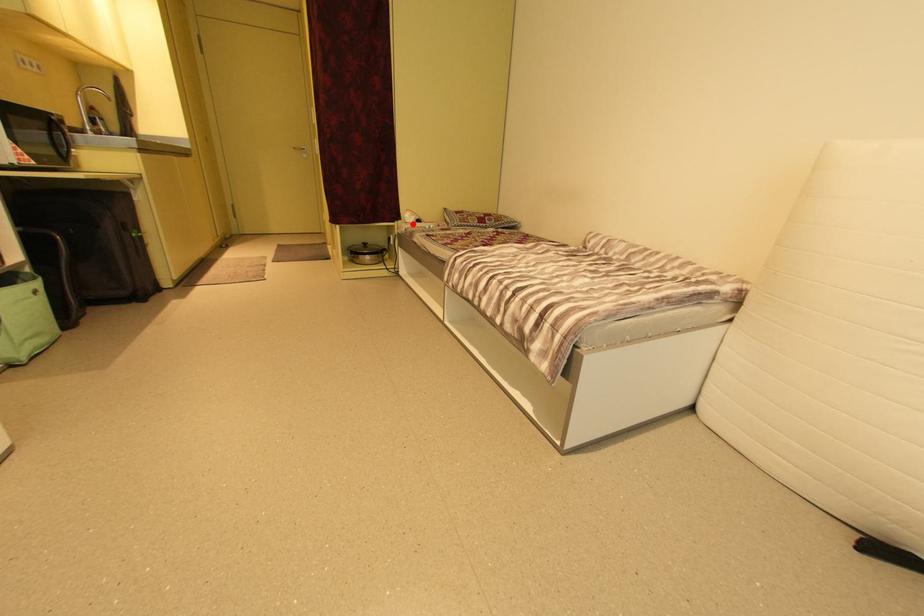
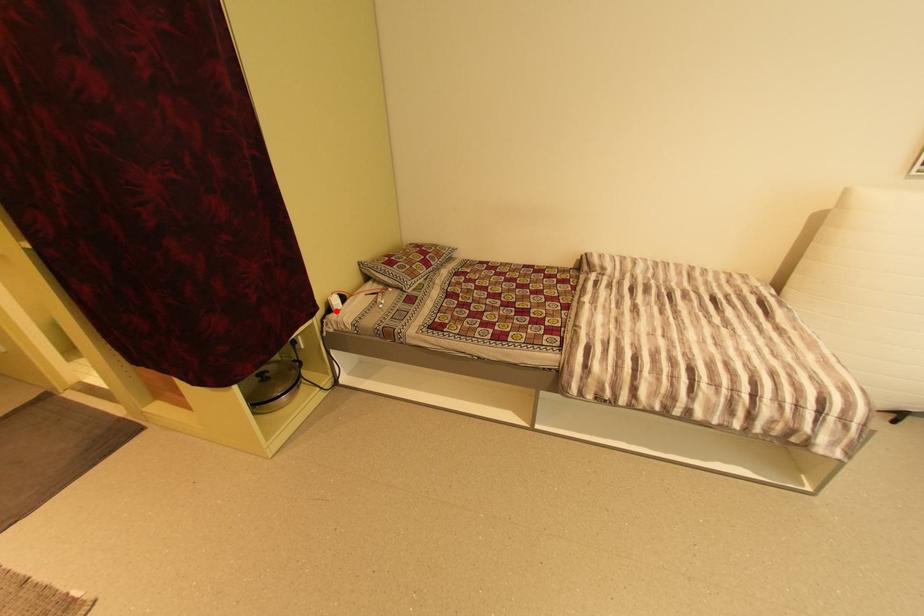
I am providing you with two images of the same scene from different viewpoints. A red point is marked on the first image and another point is marked on the second image. Does the point marked in image1 correspond to the same location as the one in image2?

Yes